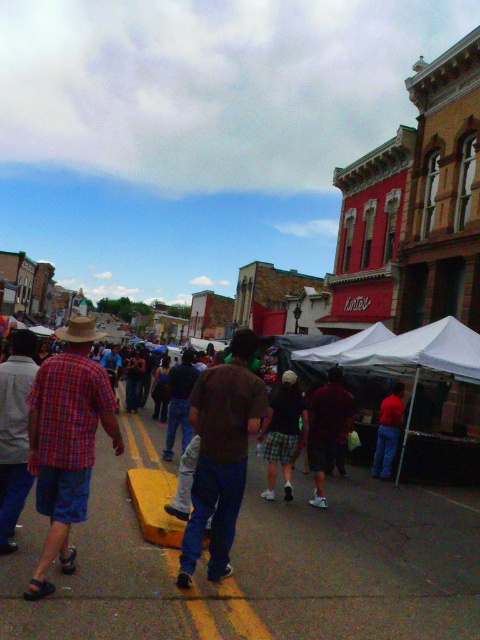
Who is positioned more to the left, brown fabric skateboard at center or brown straw cowboy hat at center?

brown straw cowboy hat at center is more to the left.

Is brown fabric skateboard at center below brown straw cowboy hat at center?

Yes.

Who is more forward, (x=227, y=572) or (x=86, y=320)?

Point (x=86, y=320)

Locate an element on the screen. Image resolution: width=480 pixels, height=640 pixels. brown fabric skateboard at center is located at coordinates (220, 454).